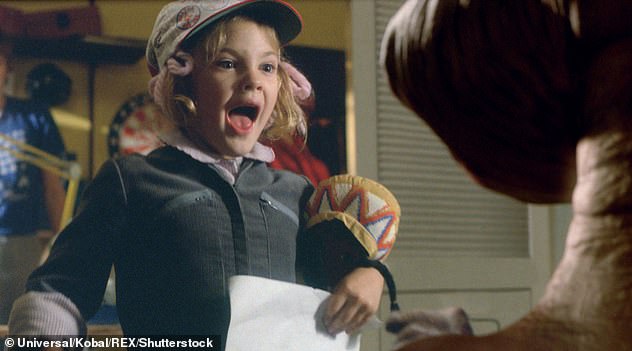
Locate an element on the screen. This screenshot has width=632, height=351. dart board is located at coordinates (140, 129).